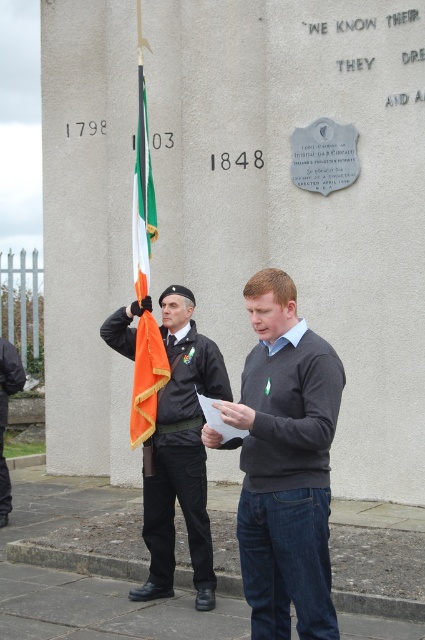
You are a visitor at the monument and want to take a photo of the matte black uniform at center without the orange fabric flag at center appearing in the frame. Is this possible given their positions?

The matte black uniform at center is positioned under the orange fabric flag at center, so if you lower your camera angle slightly to capture the matte black uniform at center, the orange fabric flag at center would be out of the frame.

You are a photographer trying to capture both the dark gray sweater at center and the orange fabric flag at center in a single frame. Given that your camera can only focus on objects wider than 10 inches, which object should you prioritize to ensure it is in focus?

The dark gray sweater at center should be prioritized because its width is larger than the orange fabric flag at center, making it more likely to be within the camera focus range of over 10 inches.